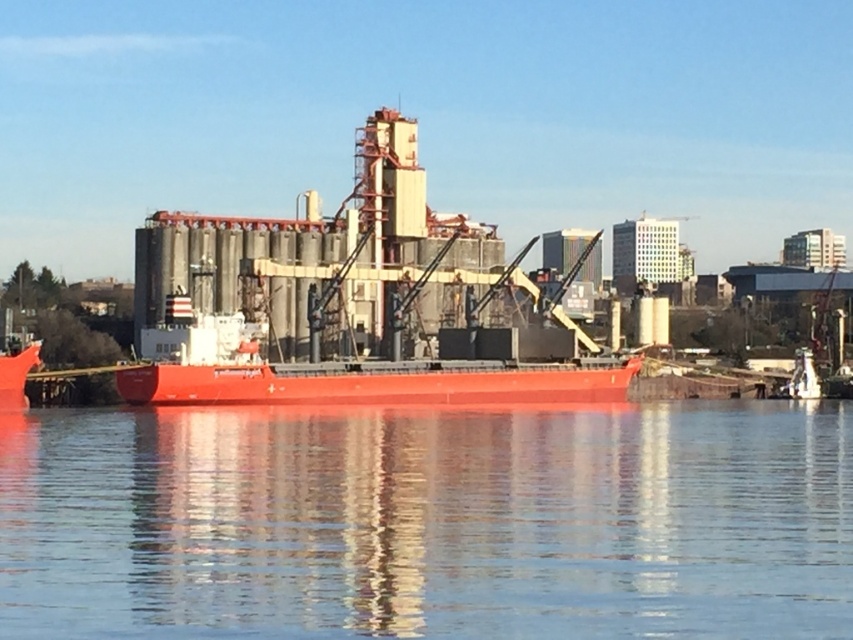
Question: Which point is closer to the camera taking this photo?

Choices:
 (A) pyautogui.click(x=100, y=492)
 (B) pyautogui.click(x=450, y=380)

Answer: (A)

Question: Can you confirm if smooth water at lower center is positioned to the left of smooth red ship at center?

Choices:
 (A) yes
 (B) no

Answer: (B)

Question: Can you confirm if smooth water at lower center is positioned to the right of smooth red ship at center?

Choices:
 (A) no
 (B) yes

Answer: (B)

Question: Is smooth water at lower center closer to the viewer compared to smooth red ship at center?

Choices:
 (A) no
 (B) yes

Answer: (B)

Question: Which of the following is the farthest from the observer?

Choices:
 (A) (438, 260)
 (B) (722, 572)

Answer: (A)